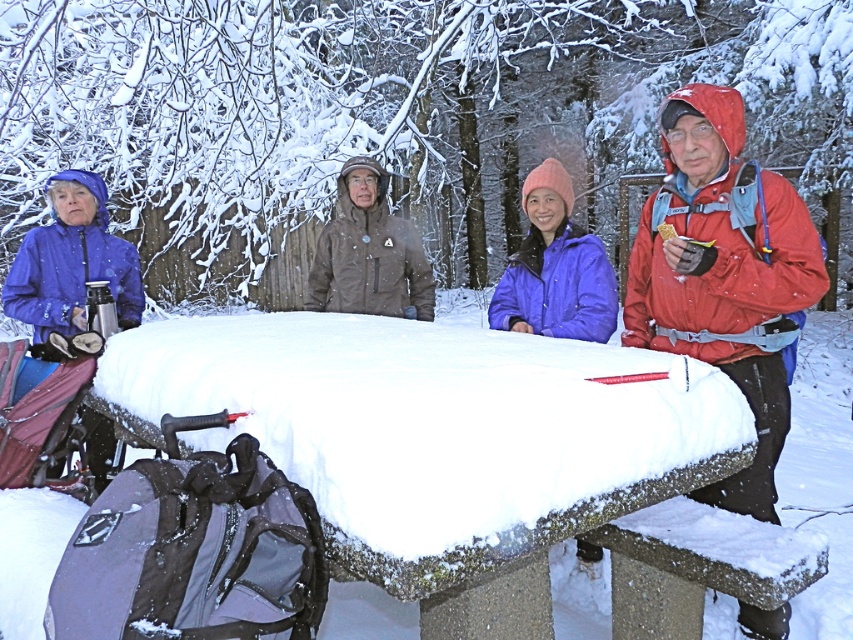
Does snow-covered concrete table at center have a smaller size compared to brown softshell jacket at center?

Actually, snow-covered concrete table at center might be larger than brown softshell jacket at center.

Does point (699, 401) lie behind point (395, 257)?

No, (699, 401) is in front of (395, 257).

Locate an element on the screen. The height and width of the screenshot is (640, 853). snow-covered concrete table at center is located at coordinates [x=438, y=429].

Does matte blue jacket at left have a lesser height compared to brown softshell jacket at center?

Correct, matte blue jacket at left is not as tall as brown softshell jacket at center.

Which is below, matte blue jacket at left or brown softshell jacket at center?

Positioned lower is matte blue jacket at left.

Locate an element on the screen. Image resolution: width=853 pixels, height=640 pixels. matte blue jacket at left is located at coordinates (71, 259).

Can you confirm if snow-covered concrete table at center is thinner than matte blue jacket at left?

In fact, snow-covered concrete table at center might be wider than matte blue jacket at left.

Is point (560, 522) positioned in front of point (57, 301)?

Yes.

At what (x,y) coordinates should I click in order to perform the action: click on snow-covered concrete table at center. Please return your answer as a coordinate pair (x, y). This screenshot has width=853, height=640. Looking at the image, I should click on (438, 429).